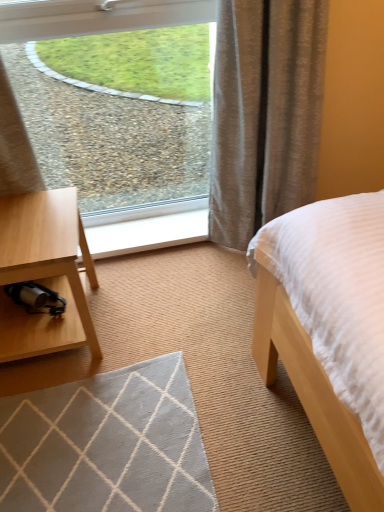
Question: Can you confirm if textured beige curtain at upper right is smaller than white wood at center?

Choices:
 (A) yes
 (B) no

Answer: (B)

Question: Does textured beige curtain at upper right have a lesser height compared to white wood at center?

Choices:
 (A) yes
 (B) no

Answer: (B)

Question: Is textured beige curtain at upper right closer to camera compared to white wood at center?

Choices:
 (A) yes
 (B) no

Answer: (A)

Question: Is white wood at center inside textured beige curtain at upper right?

Choices:
 (A) no
 (B) yes

Answer: (A)

Question: Considering the relative positions of textured beige curtain at upper right and white wood at center in the image provided, is textured beige curtain at upper right to the left of white wood at center from the viewer's perspective?

Choices:
 (A) no
 (B) yes

Answer: (A)

Question: In the image, is clear glass window at upper left on the left side or the right side of textured beige curtain at upper right?

Choices:
 (A) right
 (B) left

Answer: (B)

Question: Is clear glass window at upper left wider or thinner than textured beige curtain at upper right?

Choices:
 (A) thin
 (B) wide

Answer: (A)

Question: From a real-world perspective, is clear glass window at upper left positioned above or below textured beige curtain at upper right?

Choices:
 (A) above
 (B) below

Answer: (A)

Question: Considering the positions of clear glass window at upper left and textured beige curtain at upper right in the image, is clear glass window at upper left bigger or smaller than textured beige curtain at upper right?

Choices:
 (A) small
 (B) big

Answer: (A)

Question: Is textured beige curtain at upper right inside or outside of clear glass window at upper left?

Choices:
 (A) inside
 (B) outside

Answer: (B)

Question: From the image's perspective, is textured beige curtain at upper right above or below clear glass window at upper left?

Choices:
 (A) below
 (B) above

Answer: (A)

Question: From a real-world perspective, is textured beige curtain at upper right above or below clear glass window at upper left?

Choices:
 (A) above
 (B) below

Answer: (B)

Question: In the image, is textured beige curtain at upper right on the left side or the right side of clear glass window at upper left?

Choices:
 (A) right
 (B) left

Answer: (A)

Question: Would you say clear glass window at upper left is inside or outside white wood at center?

Choices:
 (A) inside
 (B) outside

Answer: (B)

Question: From their relative heights in the image, would you say clear glass window at upper left is taller or shorter than white wood at center?

Choices:
 (A) short
 (B) tall

Answer: (B)